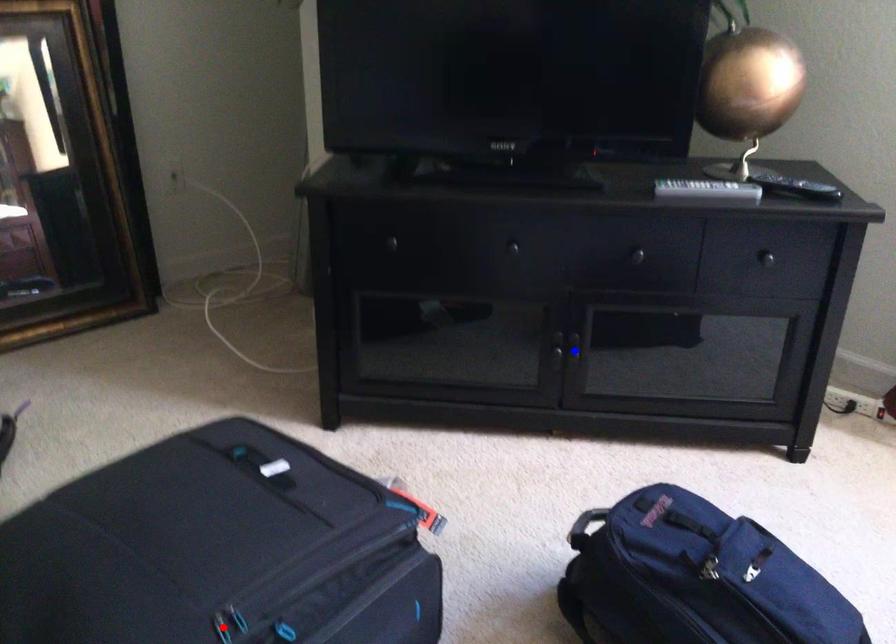
Question: In the image, two points are highlighted. Which point is nearer to the camera? Reply with the corresponding letter.

Choices:
 (A) blue point
 (B) red point

Answer: (B)